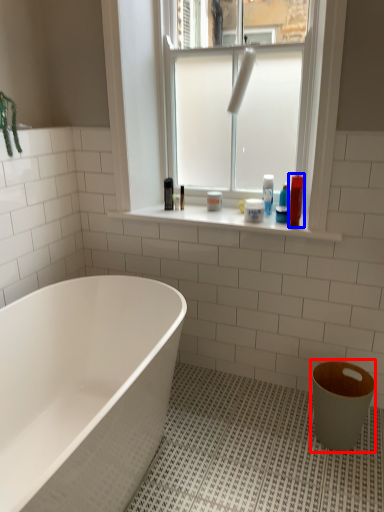
Question: Which of the following is the farthest to the observer, toilet bowl (highlighted by a red box) or toiletry (highlighted by a blue box)?

Choices:
 (A) toilet bowl
 (B) toiletry

Answer: (B)